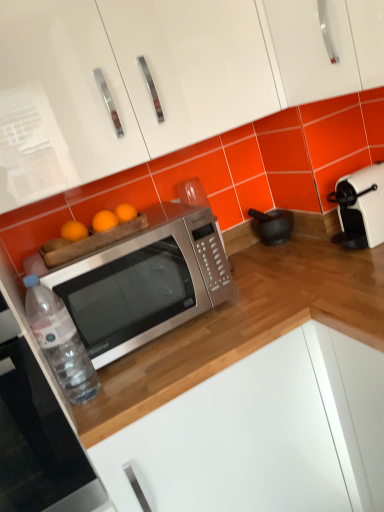
Question: Can you confirm if black matte mortar at lower center is positioned to the left of clear plastic bottle at lower left?

Choices:
 (A) yes
 (B) no

Answer: (B)

Question: Can you confirm if black matte mortar at lower center is thinner than clear plastic bottle at lower left?

Choices:
 (A) no
 (B) yes

Answer: (A)

Question: From a real-world perspective, is black matte mortar at lower center below clear plastic bottle at lower left?

Choices:
 (A) no
 (B) yes

Answer: (B)

Question: Can you confirm if black matte mortar at lower center is positioned to the right of clear plastic bottle at lower left?

Choices:
 (A) no
 (B) yes

Answer: (B)

Question: Considering the relative sizes of black matte mortar at lower center and clear plastic bottle at lower left in the image provided, is black matte mortar at lower center shorter than clear plastic bottle at lower left?

Choices:
 (A) no
 (B) yes

Answer: (B)

Question: Considering the relative sizes of black matte mortar at lower center and clear plastic bottle at lower left in the image provided, is black matte mortar at lower center taller than clear plastic bottle at lower left?

Choices:
 (A) no
 (B) yes

Answer: (A)

Question: Can you confirm if black matte mortar at lower center is thinner than white plastic toaster at right?

Choices:
 (A) no
 (B) yes

Answer: (B)

Question: Can you confirm if black matte mortar at lower center is shorter than white plastic toaster at right?

Choices:
 (A) no
 (B) yes

Answer: (B)

Question: Is black matte mortar at lower center completely or partially outside of white plastic toaster at right?

Choices:
 (A) no
 (B) yes

Answer: (B)

Question: Is black matte mortar at lower center positioned behind white plastic toaster at right?

Choices:
 (A) yes
 (B) no

Answer: (A)

Question: Is black matte mortar at lower center oriented away from white plastic toaster at right?

Choices:
 (A) yes
 (B) no

Answer: (B)

Question: From a real-world perspective, is black matte mortar at lower center under white plastic toaster at right?

Choices:
 (A) no
 (B) yes

Answer: (B)

Question: Does white plastic toaster at right appear on the right side of clear plastic bottle at lower left?

Choices:
 (A) yes
 (B) no

Answer: (A)